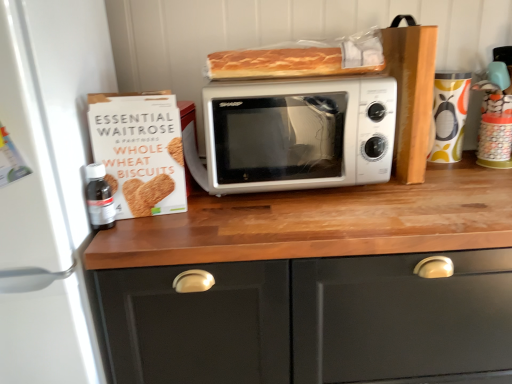
Where is `free space to the right of white matte microwave at center`? Image resolution: width=512 pixels, height=384 pixels. free space to the right of white matte microwave at center is located at coordinates (455, 192).